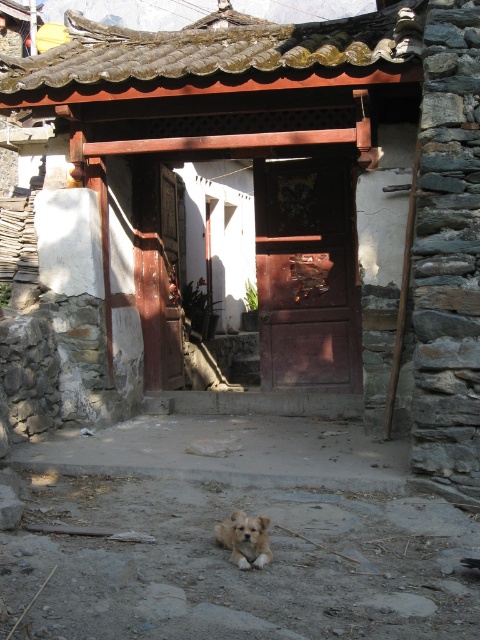
Question: From the image, what is the correct spatial relationship of wooden door at center in relation to dark wood door at center?

Choices:
 (A) right
 (B) left

Answer: (A)

Question: Can you confirm if wooden door at center is positioned to the right of light brown fur dog at center?

Choices:
 (A) no
 (B) yes

Answer: (B)

Question: Which of the following is the farthest from the observer?

Choices:
 (A) (360, 372)
 (B) (216, 109)
 (C) (225, 529)

Answer: (A)

Question: In this image, where is wooden door at center located relative to dark wood door at center?

Choices:
 (A) right
 (B) left

Answer: (A)

Question: Based on their relative distances, which object is farther from the light brown fur dog at center?

Choices:
 (A) wooden door at center
 (B) dark wood door at center

Answer: (A)

Question: Which of the following is the closest to the observer?

Choices:
 (A) (355, 324)
 (B) (315, 134)

Answer: (B)